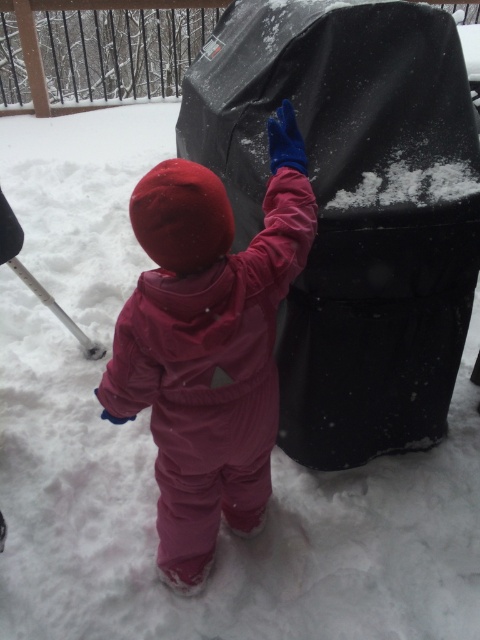
Question: Is black matte grill at center above matte pink snowsuit at center?

Choices:
 (A) no
 (B) yes

Answer: (B)

Question: Which object is closer to the camera taking this photo?

Choices:
 (A) black matte grill at center
 (B) matte pink snowsuit at center

Answer: (B)

Question: Among these points, which one is farthest from the camera?

Choices:
 (A) (230, 394)
 (B) (364, 93)

Answer: (B)

Question: Observing the image, what is the correct spatial positioning of black matte grill at center in reference to matte pink snowsuit at center?

Choices:
 (A) above
 (B) below

Answer: (A)

Question: Does black matte grill at center lie behind matte pink snowsuit at center?

Choices:
 (A) yes
 (B) no

Answer: (A)